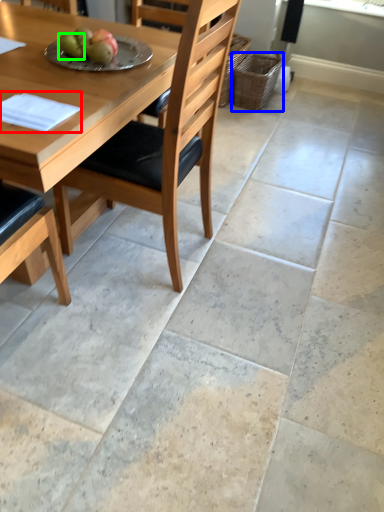
Question: Based on their relative distances, which object is nearer to pad (highlighted by a red box)? Choose from basket (highlighted by a blue box) and fruit (highlighted by a green box).

Choices:
 (A) basket
 (B) fruit

Answer: (B)